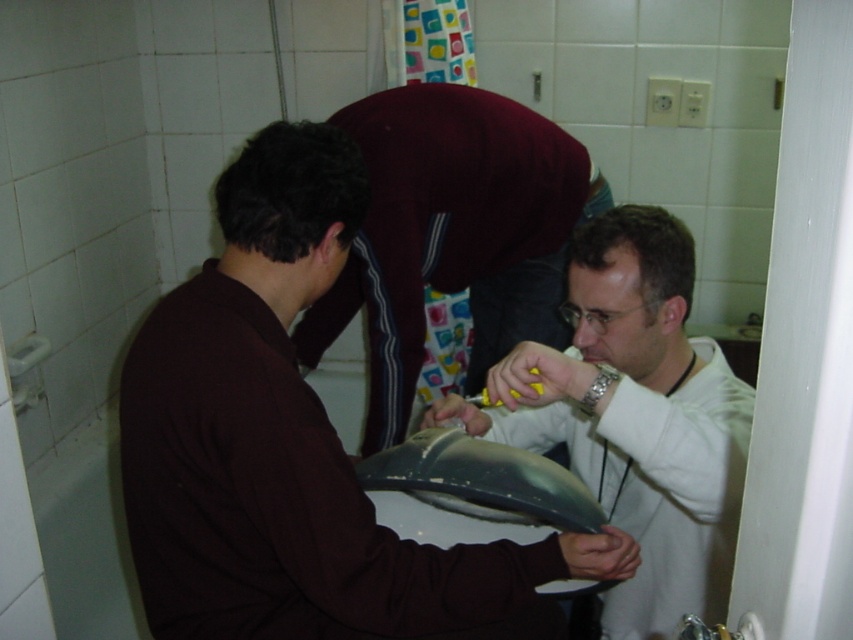
You are a technician trying to place a metallic silver laptop at center on top of a shelf next to the maroon fabric shirt at center. Can the laptop fit vertically without tilting, considering their heights?

The metallic silver laptop at center is not as tall as the maroon fabric shirt at center. Since the shirt is taller, the laptop can fit vertically on the shelf without tilting.

You are a technician trying to access the metallic silver laptop at center and the maroon fabric shirt at center. Which object is easier to reach without moving your current position?

The metallic silver laptop at center is closer to the viewer than the maroon fabric shirt at center, so it is easier to reach without moving.

In the scene shown: You are a technician trying to locate your tools. You see the matte black laptop at center and the maroon fabric shirt at center. Which item is positioned lower?

The matte black laptop at center is located below the maroon fabric shirt at center, so the matte black laptop at center is positioned lower.